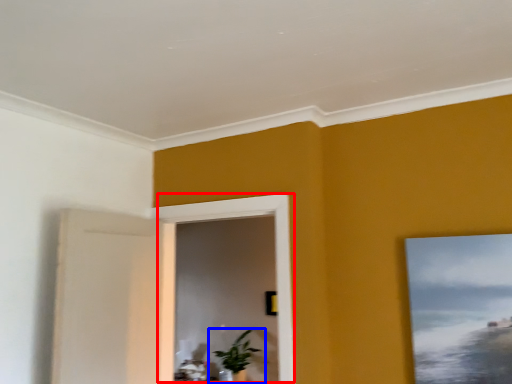
Question: Which of the following is the farthest to the observer, window (highlighted by a red box) or houseplant (highlighted by a blue box)?

Choices:
 (A) window
 (B) houseplant

Answer: (B)